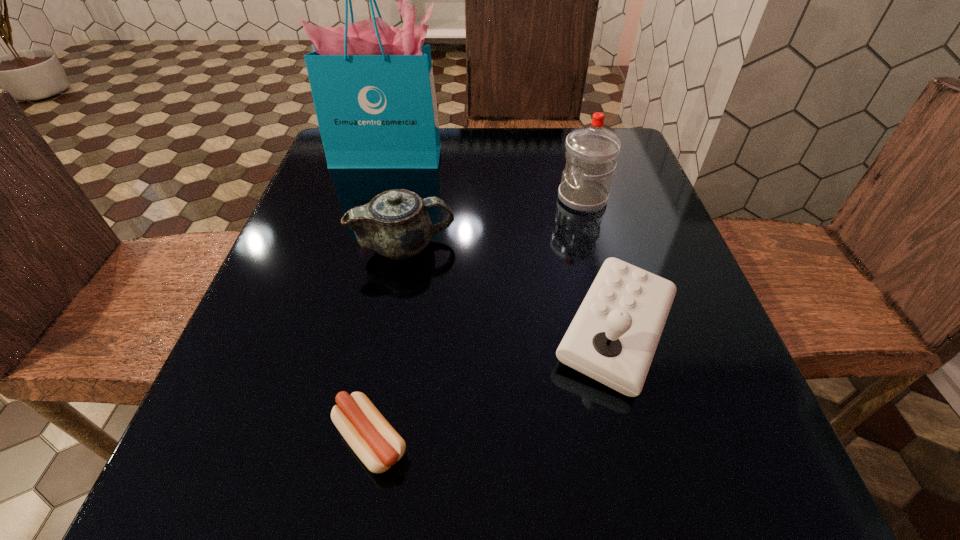
You are a GUI agent. You are given a task and a screenshot of the screen. Output one action in this format:
    pyautogui.click(x=<x>, y=<y>)
    Task: Click on the free spot between the second nearest object and the tallest object
    The width and height of the screenshot is (960, 540).
    Given the screenshot: What is the action you would take?
    pyautogui.click(x=503, y=244)

You are a GUI agent. You are given a task and a screenshot of the screen. Output one action in this format:
    pyautogui.click(x=<x>, y=<y>)
    Task: Click on the blank region between the second nearest object and the chinaware
    The width and height of the screenshot is (960, 540).
    Given the screenshot: What is the action you would take?
    pyautogui.click(x=511, y=288)

The width and height of the screenshot is (960, 540). Identify the location of empty location between the third nearest object and the shortest object. (388, 343).

Where is `free space between the third farthest object and the second farthest object`? free space between the third farthest object and the second farthest object is located at coordinates (493, 222).

Identify the location of free point between the shortest object and the farthest object. This screenshot has height=540, width=960. (380, 298).

Select which object is the closest to the farthest object. Please provide its 2D coordinates. Your answer should be formatted as a tuple, i.e. [(x, y)], where the tuple contains the x and y coordinates of a point satisfying the conditions above.

[(395, 223)]

Identify which object is located as the nearest to the third farthest object. Please provide its 2D coordinates. Your answer should be formatted as a tuple, i.e. [(x, y)], where the tuple contains the x and y coordinates of a point satisfying the conditions above.

[(613, 337)]

Locate an element on the screen. free space in the image that satisfies the following two spatial constraints: 1. from the spout of the nearest object; 2. on the right side of the chinaware is located at coordinates click(x=371, y=440).

The width and height of the screenshot is (960, 540). I want to click on vacant space that satisfies the following two spatial constraints: 1. on the back side of the nearest object; 2. from the spout of the third farthest object, so click(405, 246).

Image resolution: width=960 pixels, height=540 pixels. I want to click on vacant area that satisfies the following two spatial constraints: 1. on the back side of the sausage; 2. from the spout of the chinaware, so click(x=405, y=246).